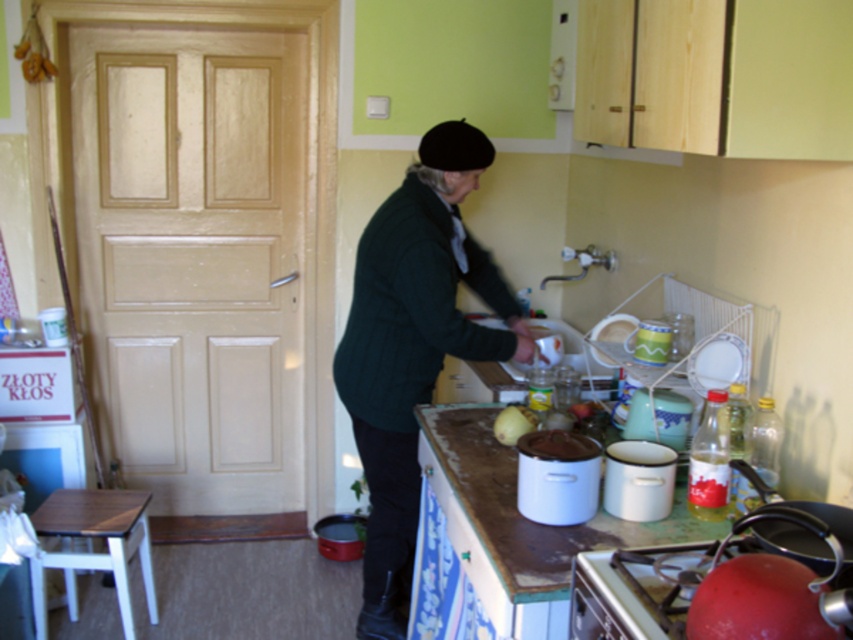
Question: Is dark green sweater at center in front of wooden stool at lower left?

Choices:
 (A) no
 (B) yes

Answer: (B)

Question: Which of the following is the farthest from the observer?

Choices:
 (A) (461, 240)
 (B) (517, 433)
 (C) (115, 518)
 (D) (659, 618)

Answer: (C)

Question: Can you confirm if metallic silver stove at lower right is smaller than wooden stool at lower left?

Choices:
 (A) yes
 (B) no

Answer: (A)

Question: Which point is farther from the camera taking this photo?

Choices:
 (A) (500, 440)
 (B) (509, 496)

Answer: (A)

Question: Which of these objects is positioned farthest from the yellow matte onion at center?

Choices:
 (A) dark green sweater at center
 (B) metallic silver stove at lower right

Answer: (B)

Question: Is dark green sweater at center positioned behind wooden stool at lower left?

Choices:
 (A) no
 (B) yes

Answer: (A)